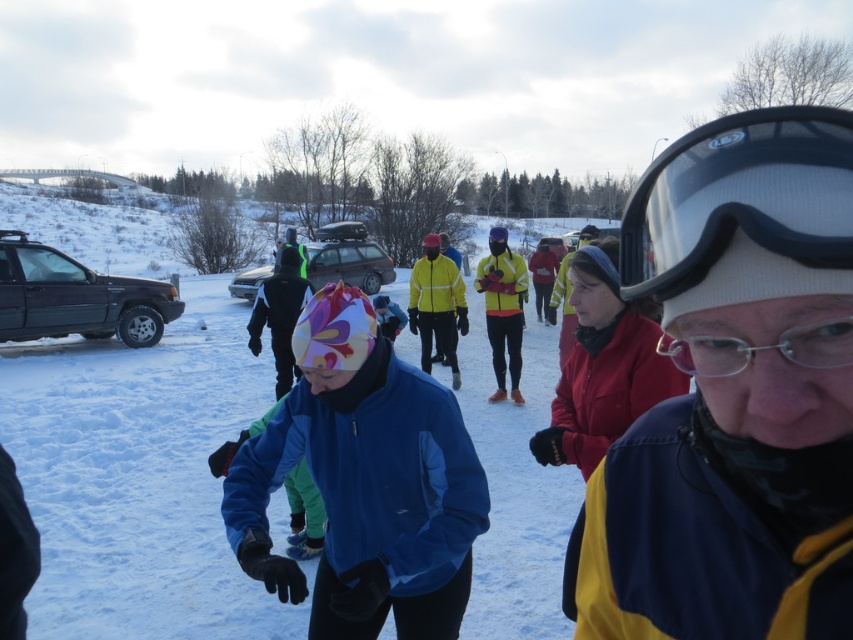
Question: Which point is closer to the camera taking this photo?

Choices:
 (A) (328, 592)
 (B) (840, 177)
 (C) (4, 428)

Answer: (B)

Question: Which object is the farthest from the blue fleece jacket at center?

Choices:
 (A) yellow and blue jacket at center
 (B) white fluffy snow at center
 (C) transparent plastic goggles at upper right

Answer: (B)

Question: Can you confirm if yellow and blue jacket at center is positioned to the left of white fluffy snow at center?

Choices:
 (A) yes
 (B) no

Answer: (B)

Question: Which is nearer to the white fluffy snow at center?

Choices:
 (A) transparent plastic goggles at upper right
 (B) yellow and blue jacket at center

Answer: (B)

Question: Considering the relative positions of white fluffy snow at center and transparent plastic goggles at upper right in the image provided, where is white fluffy snow at center located with respect to transparent plastic goggles at upper right?

Choices:
 (A) left
 (B) right

Answer: (A)

Question: Does yellow and blue jacket at center lie in front of blue fleece jacket at center?

Choices:
 (A) yes
 (B) no

Answer: (A)